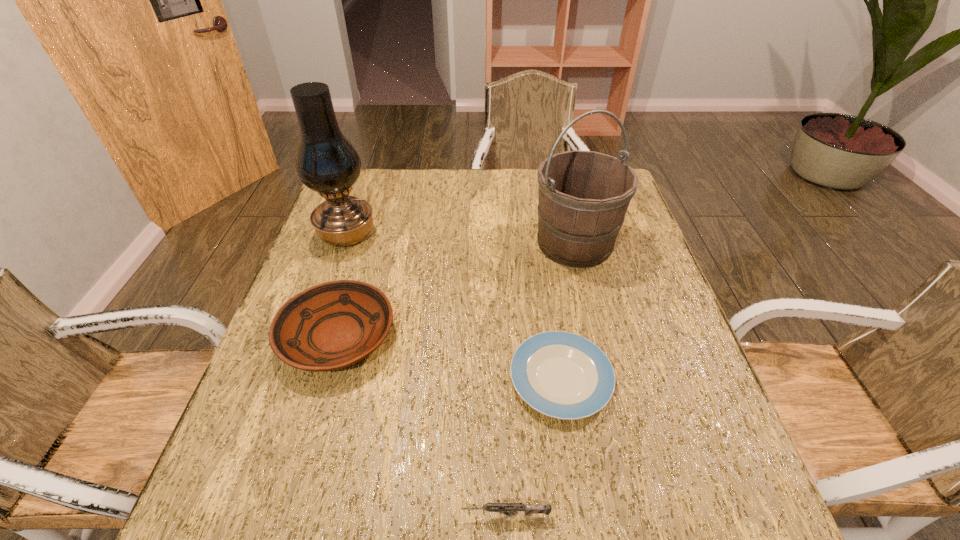
Where is `free spot at the near edge of the desktop`? This screenshot has width=960, height=540. free spot at the near edge of the desktop is located at coordinates (546, 527).

This screenshot has height=540, width=960. I want to click on free space at the left edge, so click(x=324, y=384).

The width and height of the screenshot is (960, 540). Find the location of `vacant space at the right edge of the desktop`. vacant space at the right edge of the desktop is located at coordinates (639, 416).

I want to click on free space at the near left corner of the desktop, so click(x=226, y=492).

Where is `empty space between the bucket and the third tallest object`? empty space between the bucket and the third tallest object is located at coordinates (456, 290).

At what (x,y) coordinates should I click in order to perform the action: click on vacant area between the shorter plate and the oil lamp. Please return your answer as a coordinate pair (x, y). The image size is (960, 540). Looking at the image, I should click on (454, 306).

At what (x,y) coordinates should I click in order to perform the action: click on vacant region between the right plate and the bucket. Please return your answer as a coordinate pair (x, y). Looking at the image, I should click on (567, 310).

You are a GUI agent. You are given a task and a screenshot of the screen. Output one action in this format:
    pyautogui.click(x=<x>, y=<y>)
    Task: Click on the vacant space in between the bucket and the shortest object
    The width and height of the screenshot is (960, 540).
    Given the screenshot: What is the action you would take?
    pyautogui.click(x=567, y=310)

Identify the location of free point between the bucket and the shortest object. This screenshot has width=960, height=540. (567, 310).

This screenshot has width=960, height=540. What are the coordinates of `empty space that is in between the bucket and the oil lamp` in the screenshot? It's located at (461, 239).